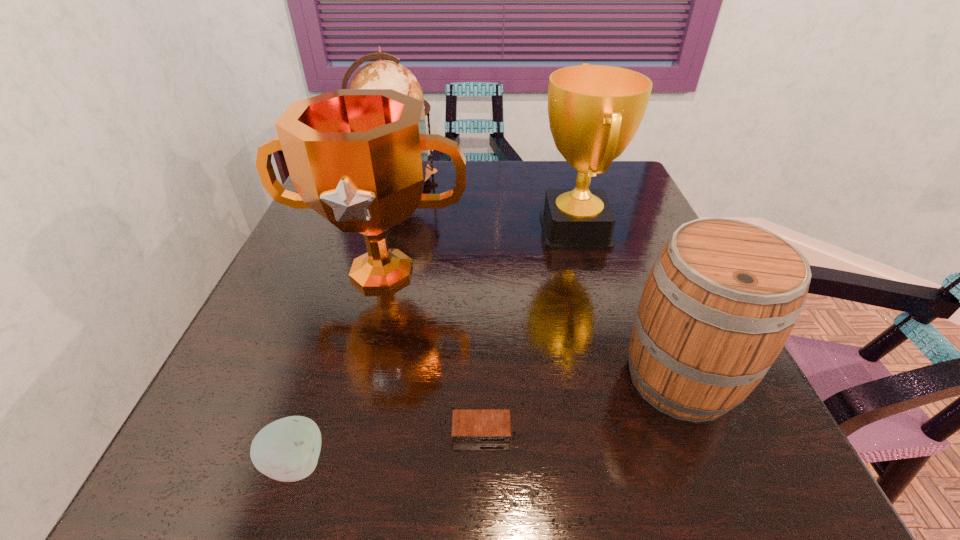
Locate an element on the screen. The image size is (960, 540). free location located 0.260m on the side of the left award with the star emblem is located at coordinates (342, 428).

At what (x,y) coordinates should I click in order to perform the action: click on free space located on the left of the fourth tallest object. Please return your answer as a coordinate pair (x, y). Image resolution: width=960 pixels, height=540 pixels. Looking at the image, I should click on (565, 378).

Locate an element on the screen. The image size is (960, 540). blank area located 0.270m on the back of the apple is located at coordinates (344, 313).

Locate an element on the screen. The image size is (960, 540). vacant region located 0.050m on the front face of the alarm clock is located at coordinates (482, 476).

Find the location of `globe at the far edge`. globe at the far edge is located at coordinates point(382,74).

At what (x,y) coordinates should I click in order to perform the action: click on award present at the far edge. Please return your answer as a coordinate pair (x, y). The image size is (960, 540). Looking at the image, I should click on (594, 111).

This screenshot has height=540, width=960. I want to click on apple positioned at the near edge, so 287,450.

Where is `alarm clock at the near edge`? alarm clock at the near edge is located at coordinates (469, 426).

Locate an element on the screen. Image resolution: width=960 pixels, height=540 pixels. globe at the left edge is located at coordinates (382, 74).

What are the coordinates of `award that is at the left edge` in the screenshot? It's located at (358, 157).